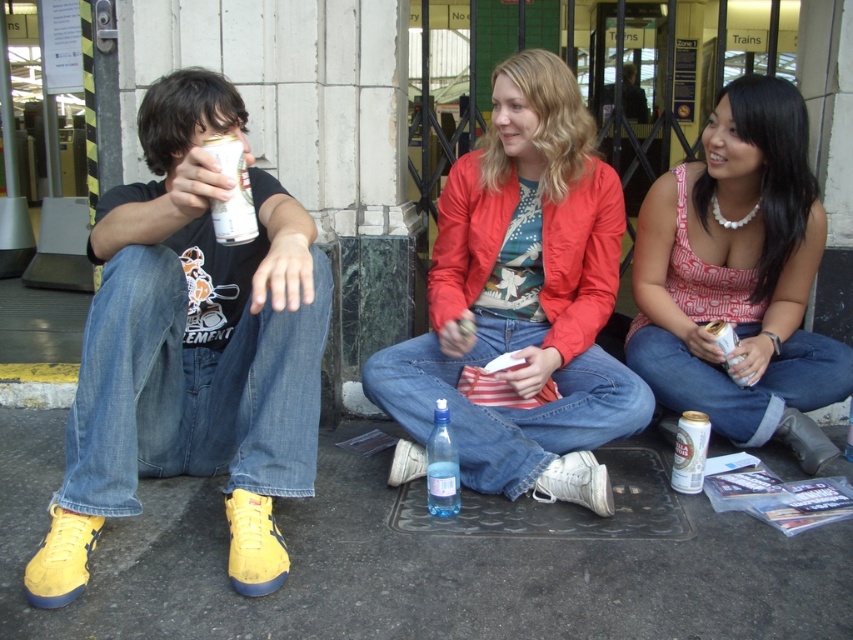
You are a photographer trying to capture a closeup of the silver metallic can at left without including the yellow suede sneakers at left in the frame. Given their sizes, is this feasible?

The yellow suede sneakers at left has a larger size compared to the silver metallic can at left. Since the sneakers are larger, it might be challenging to frame the can without including the sneakers if they are positioned closely together. Adjust your angle or move closer to isolate the can.

You are a photographer taking a picture of the scene. You notice the yellow suede sneakers at left and the silver metallic can at left. Which object should you focus on first if you want to capture both in the same frame without moving the camera?

The yellow suede sneakers at left is located below the silver metallic can at left, so focusing on the silver metallic can at left first would ensure both are in the frame as the sneakers are positioned lower.